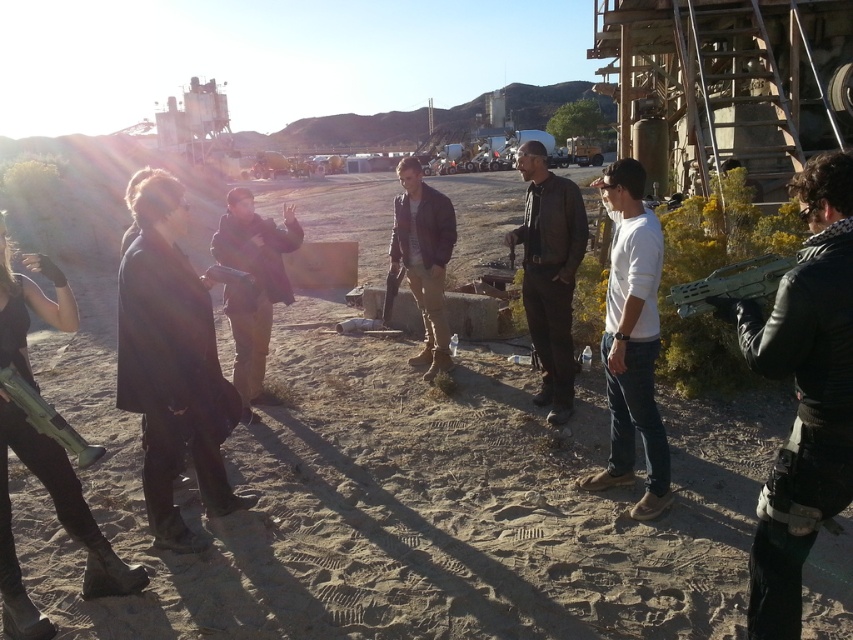
Question: Among these points, which one is nearest to the camera?

Choices:
 (A) (784, 275)
 (B) (79, 634)
 (C) (235, 264)

Answer: (A)

Question: Among these points, which one is farthest from the camera?

Choices:
 (A) (454, 218)
 (B) (606, 298)
 (C) (234, 211)

Answer: (A)

Question: Which object is positioned farthest from the brown fuzzy coat at center?

Choices:
 (A) leather jacket at center
 (B) dark gray coat at center
 (C) leather jacket at right

Answer: (C)

Question: Can you confirm if brown sandy dirt field at center is thinner than dark gray coat at center?

Choices:
 (A) yes
 (B) no

Answer: (B)

Question: Does leather jacket at right appear over leather jacket at center?

Choices:
 (A) yes
 (B) no

Answer: (B)

Question: Observing the image, what is the correct spatial positioning of brown sandy dirt field at center in reference to dark brown leather jacket at center?

Choices:
 (A) left
 (B) right

Answer: (A)